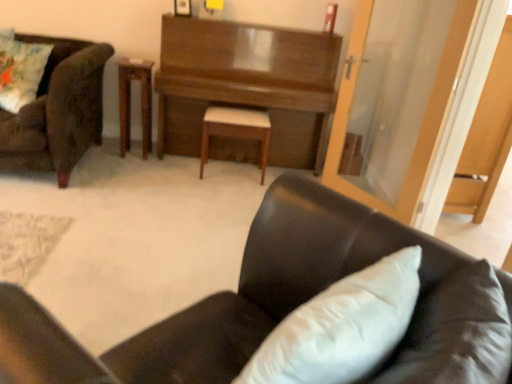
Question: Is black leather chair at lower right, the second chair when ordered from left to right, facing towards white leather stool at center?

Choices:
 (A) yes
 (B) no

Answer: (B)

Question: Is black leather chair at lower right, the second chair in the back-to-front sequence, bigger than white leather stool at center?

Choices:
 (A) yes
 (B) no

Answer: (A)

Question: Is black leather chair at lower right, the second chair in the back-to-front sequence, taller than white leather stool at center?

Choices:
 (A) no
 (B) yes

Answer: (B)

Question: Can white leather stool at center be found inside black leather chair at lower right, the first chair in the bottom-to-top sequence?

Choices:
 (A) yes
 (B) no

Answer: (B)

Question: From a real-world perspective, does black leather chair at lower right, positioned as the 1th chair in front-to-back order, sit lower than white leather stool at center?

Choices:
 (A) no
 (B) yes

Answer: (A)

Question: From the image's perspective, is black leather chair at lower right, the second chair when ordered from left to right, beneath white leather stool at center?

Choices:
 (A) yes
 (B) no

Answer: (A)

Question: Can you confirm if white leather stool at center is thinner than transparent glass door at upper right?

Choices:
 (A) yes
 (B) no

Answer: (B)

Question: Is white leather stool at center smaller than transparent glass door at upper right?

Choices:
 (A) yes
 (B) no

Answer: (A)

Question: Could you tell me if white leather stool at center is facing transparent glass door at upper right?

Choices:
 (A) no
 (B) yes

Answer: (A)

Question: Is white leather stool at center not within transparent glass door at upper right?

Choices:
 (A) yes
 (B) no

Answer: (A)

Question: Can you confirm if white leather stool at center is shorter than transparent glass door at upper right?

Choices:
 (A) no
 (B) yes

Answer: (B)

Question: Is white leather stool at center at the left side of transparent glass door at upper right?

Choices:
 (A) yes
 (B) no

Answer: (A)

Question: Is black leather chair at lower right, the second chair viewed from the top, at the back of wooden table at center?

Choices:
 (A) yes
 (B) no

Answer: (B)